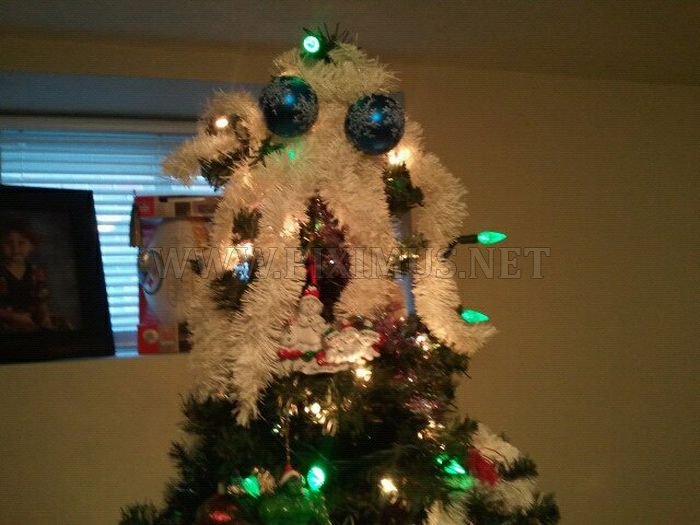
This screenshot has height=525, width=700. Identify the location of picture. (33, 246).